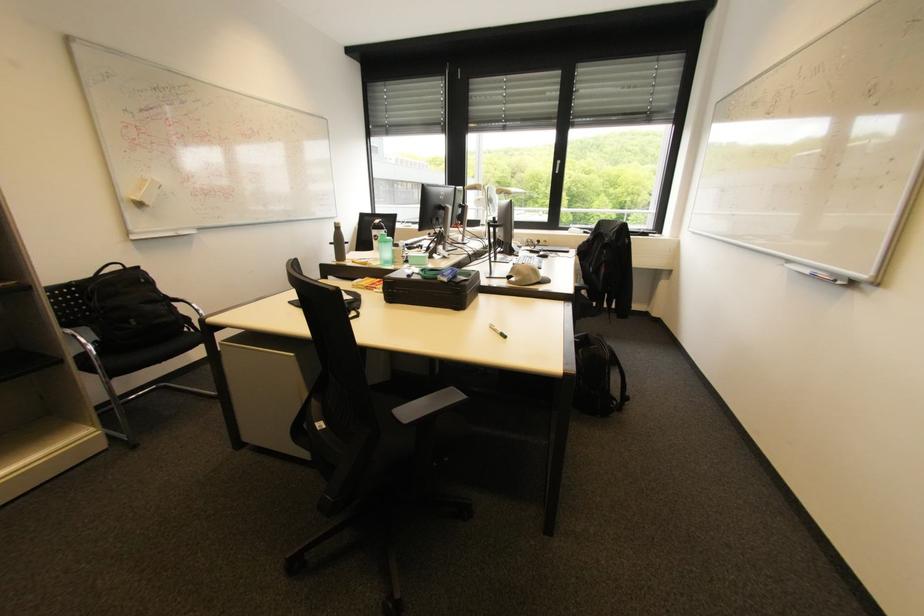
Where would you resting arm the black chair armrest? Please return your answer as a coordinate pair (x, y).

(428, 406)